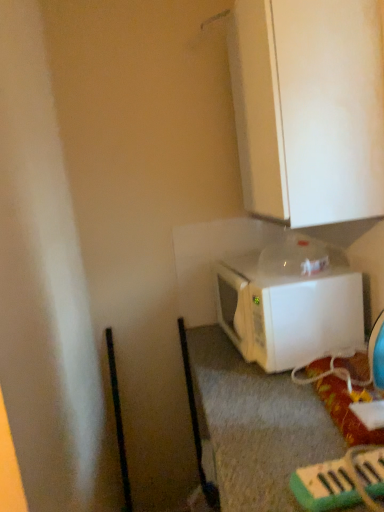
This screenshot has height=512, width=384. What do you see at coordinates (289, 303) in the screenshot?
I see `white matte microwave at lower right` at bounding box center [289, 303].

Identify the location of white matte microwave at lower right. (289, 303).

At what (x,y) coordinates should I click in order to perform the action: click on white matte cabinet at upper center. Please return your answer as a coordinate pair (x, y). Looking at the image, I should click on (309, 108).

The width and height of the screenshot is (384, 512). Describe the element at coordinates (309, 108) in the screenshot. I see `white matte cabinet at upper center` at that location.

Locate an element on the screen. This screenshot has height=512, width=384. white matte microwave at lower right is located at coordinates pos(289,303).

Based on their positions, is white matte microwave at lower right located to the left or right of white matte cabinet at upper center?

Clearly, white matte microwave at lower right is on the left of white matte cabinet at upper center in the image.

Which is in front, white matte microwave at lower right or white matte cabinet at upper center?

Positioned in front is white matte cabinet at upper center.

Does point (250, 320) come closer to viewer compared to point (362, 139)?

That is False.

From the image's perspective, which one is positioned higher, white matte microwave at lower right or white matte cabinet at upper center?

white matte cabinet at upper center appears higher in the image.

From a real-world perspective, is white matte microwave at lower right positioned under white matte cabinet at upper center based on gravity?

Yes, from a real-world perspective, white matte microwave at lower right is under white matte cabinet at upper center.

From the picture: Considering the relative sizes of white matte microwave at lower right and white matte cabinet at upper center in the image provided, is white matte microwave at lower right thinner than white matte cabinet at upper center?

No.

From their relative heights in the image, would you say white matte microwave at lower right is taller or shorter than white matte cabinet at upper center?

Considering their sizes, white matte microwave at lower right has less height than white matte cabinet at upper center.

Does white matte microwave at lower right have a larger size compared to white matte cabinet at upper center?

Actually, white matte microwave at lower right might be smaller than white matte cabinet at upper center.

Could white matte cabinet at upper center be considered to be inside white matte microwave at lower right?

No.

Does white matte microwave at lower right touch white matte cabinet at upper center?

No, white matte microwave at lower right is not beside white matte cabinet at upper center.

Is white matte microwave at lower right turned away from white matte cabinet at upper center?

No, white matte microwave at lower right is not facing away from white matte cabinet at upper center.

What's the angular difference between white matte microwave at lower right and white matte cabinet at upper center's facing directions?

7.67 degrees separate the facing orientations of white matte microwave at lower right and white matte cabinet at upper center.

The width and height of the screenshot is (384, 512). In order to click on microwave oven beneath the white matte cabinet at upper center (from a real-world perspective) in this screenshot , I will do `click(289, 303)`.

In the image, is white matte cabinet at upper center on the left side or the right side of white matte microwave at lower right?

white matte cabinet at upper center is positioned on white matte microwave at lower right's right side.

Considering the relative positions of white matte cabinet at upper center and white matte microwave at lower right in the image provided, is white matte cabinet at upper center behind white matte microwave at lower right?

No, it is not.

Is point (369, 86) positioned after point (282, 303)?

No, (369, 86) is in front of (282, 303).

From the image's perspective, between white matte cabinet at upper center and white matte microwave at lower right, which one is located above?

white matte cabinet at upper center.

From a real-world perspective, which object rests below the other?

From a 3D spatial view, white matte microwave at lower right is below.

Does white matte cabinet at upper center have a greater width compared to white matte microwave at lower right?

No, white matte cabinet at upper center is not wider than white matte microwave at lower right.

Is white matte cabinet at upper center taller or shorter than white matte microwave at lower right?

Clearly, white matte cabinet at upper center is taller compared to white matte microwave at lower right.

Which of these two, white matte cabinet at upper center or white matte microwave at lower right, is smaller?

white matte microwave at lower right is smaller.

Is white matte microwave at lower right a part of white matte cabinet at upper center?

No, white matte microwave at lower right is not inside white matte cabinet at upper center.

Can you see white matte cabinet at upper center touching white matte microwave at lower right?

No, white matte cabinet at upper center is not making contact with white matte microwave at lower right.

Is white matte cabinet at upper center looking in the opposite direction of white matte microwave at lower right?

No, white matte cabinet at upper center is not facing the opposite direction of white matte microwave at lower right.

What's the angular difference between white matte cabinet at upper center and white matte microwave at lower right's facing directions?

7.67 degrees separate the facing orientations of white matte cabinet at upper center and white matte microwave at lower right.

How far apart are white matte cabinet at upper center and white matte microwave at lower right?

17.14 inches.

The image size is (384, 512). Find the location of `microwave oven on the left side of white matte cabinet at upper center`. microwave oven on the left side of white matte cabinet at upper center is located at coordinates (289, 303).

The image size is (384, 512). Find the location of `microwave oven behind the white matte cabinet at upper center`. microwave oven behind the white matte cabinet at upper center is located at coordinates (289, 303).

At what (x,y) coordinates should I click in order to perform the action: click on cabinetry located in front of the white matte microwave at lower right. Please return your answer as a coordinate pair (x, y). The height and width of the screenshot is (512, 384). Looking at the image, I should click on (309, 108).